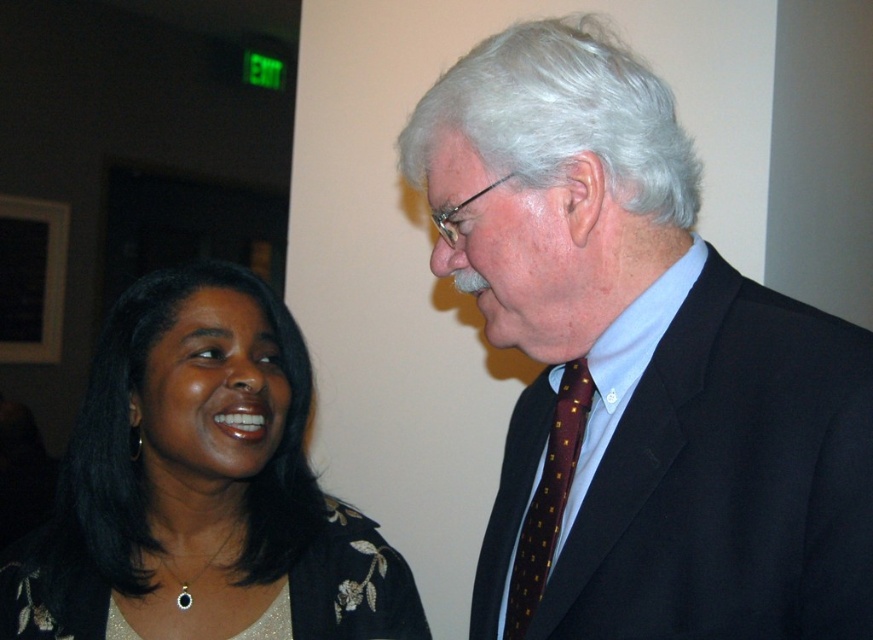
Identify the location of black satin blouse at lower left. (203, 488).

Is black satin blouse at lower left smaller than maroon dotted tie at right?

No.

The height and width of the screenshot is (640, 873). Describe the element at coordinates (203, 488) in the screenshot. I see `black satin blouse at lower left` at that location.

Image resolution: width=873 pixels, height=640 pixels. I want to click on black satin blouse at lower left, so click(x=203, y=488).

Is dark blue suit at center to the left of satin black dress at lower left from the viewer's perspective?

No, dark blue suit at center is not to the left of satin black dress at lower left.

Between dark blue suit at center and satin black dress at lower left, which one has less height?

With less height is satin black dress at lower left.

Locate an element on the screen. Image resolution: width=873 pixels, height=640 pixels. dark blue suit at center is located at coordinates (640, 365).

The image size is (873, 640). What are the coordinates of `dark blue suit at center` in the screenshot? It's located at (640, 365).

Can you confirm if dark blue suit at center is taller than black satin blouse at lower left?

Yes, dark blue suit at center is taller than black satin blouse at lower left.

Is dark blue suit at center to the right of black satin blouse at lower left from the viewer's perspective?

Correct, you'll find dark blue suit at center to the right of black satin blouse at lower left.

Between point (526, 316) and point (131, 301), which one is positioned in front?

Point (526, 316) is in front.

Where is `dark blue suit at center`? The image size is (873, 640). dark blue suit at center is located at coordinates (640, 365).